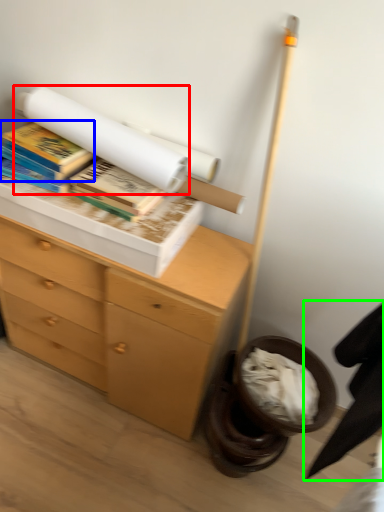
Question: Based on their relative distances, which object is nearer to book (highlighted by a red box)? Choose from book (highlighted by a blue box) and swivel chair (highlighted by a green box).

Choices:
 (A) book
 (B) swivel chair

Answer: (A)